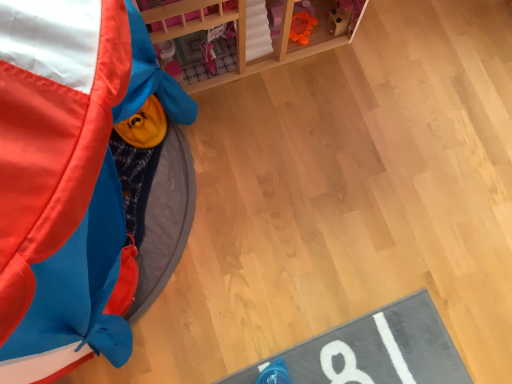
Locate an element on the screen. This screenshot has width=512, height=384. vacant area that lies between wooden dollhouse at upper center and rubberized yellow toy at upper left is located at coordinates (256, 170).